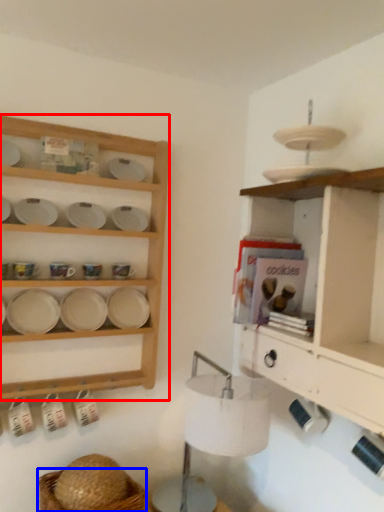
Question: Which point is closer to the camera, shelf (highlighted by a red box) or basket (highlighted by a blue box)?

Choices:
 (A) shelf
 (B) basket

Answer: (B)